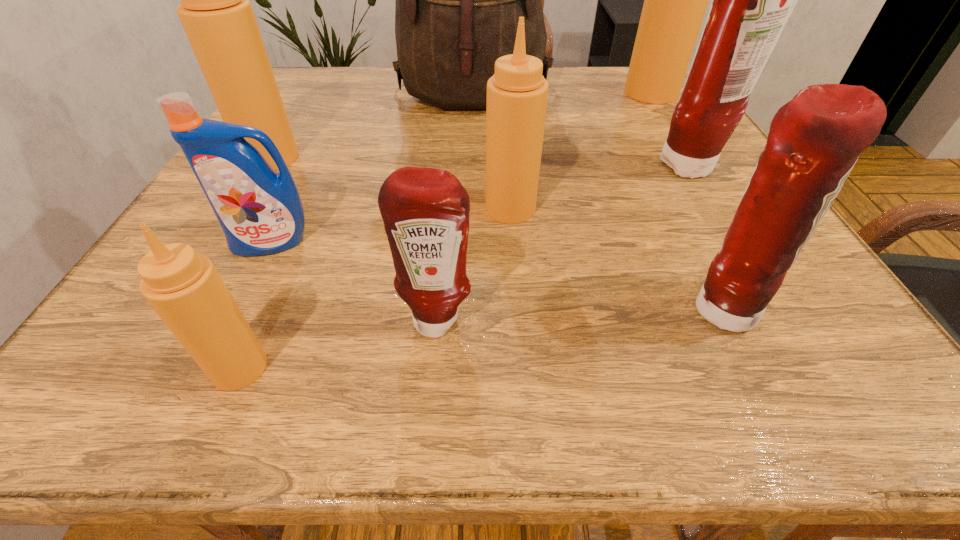
At what (x,y) coordinates should I click in order to perform the action: click on free space that satisfies the following two spatial constraints: 1. on the label of the second biggest red condiment; 2. on the right side of the sixth farthest object. Please return your answer as a coordinate pair (x, y). The image size is (960, 540). Looking at the image, I should click on (239, 309).

Find the location of `vacant position in the image that satisfies the following two spatial constraints: 1. on the back side of the leftmost red condiment; 2. on the left side of the biggest tan condiment`. vacant position in the image that satisfies the following two spatial constraints: 1. on the back side of the leftmost red condiment; 2. on the left side of the biggest tan condiment is located at coordinates (456, 93).

Where is `free space in the image that satisfies the following two spatial constraints: 1. on the label of the second smallest red condiment; 2. on the right side of the detergent`? The width and height of the screenshot is (960, 540). free space in the image that satisfies the following two spatial constraints: 1. on the label of the second smallest red condiment; 2. on the right side of the detergent is located at coordinates (239, 309).

At what (x,y) coordinates should I click in order to perform the action: click on free space that satisfies the following two spatial constraints: 1. on the label of the fourth nearest object; 2. on the right side of the smallest tan condiment. Please return your answer as a coordinate pair (x, y). Image resolution: width=960 pixels, height=540 pixels. Looking at the image, I should click on (211, 368).

The height and width of the screenshot is (540, 960). In order to click on free space in the image that satisfies the following two spatial constraints: 1. on the back side of the tallest condiment; 2. on the left side of the second smallest red condiment in this screenshot , I will do `click(612, 93)`.

At what (x,y) coordinates should I click in order to perform the action: click on free space that satisfies the following two spatial constraints: 1. on the open flap of the farthest red condiment; 2. on the left side of the backpack. Please return your answer as a coordinate pair (x, y). The width and height of the screenshot is (960, 540). Looking at the image, I should click on (471, 167).